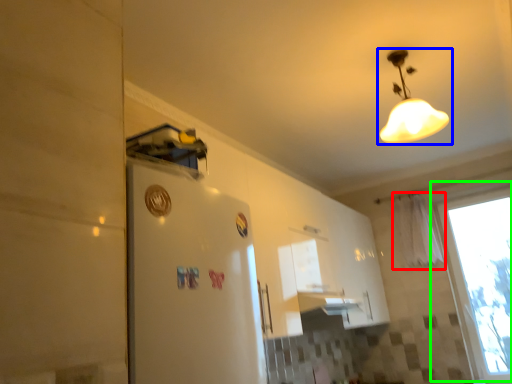
Question: Estimate the real-world distances between objects in this image. Which object is farther from curtain (highlighted by a red box), lamp (highlighted by a blue box) or window (highlighted by a green box)?

Choices:
 (A) lamp
 (B) window

Answer: (A)